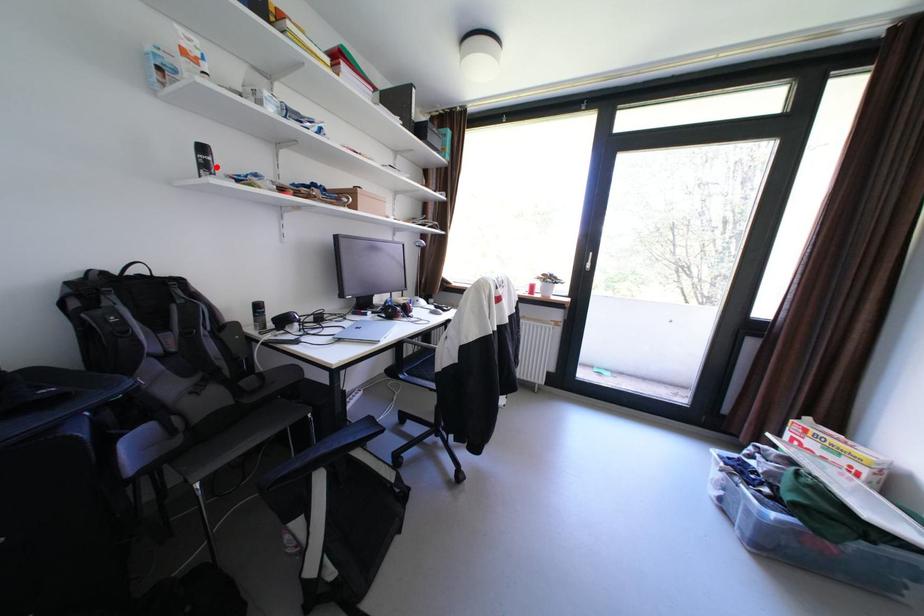
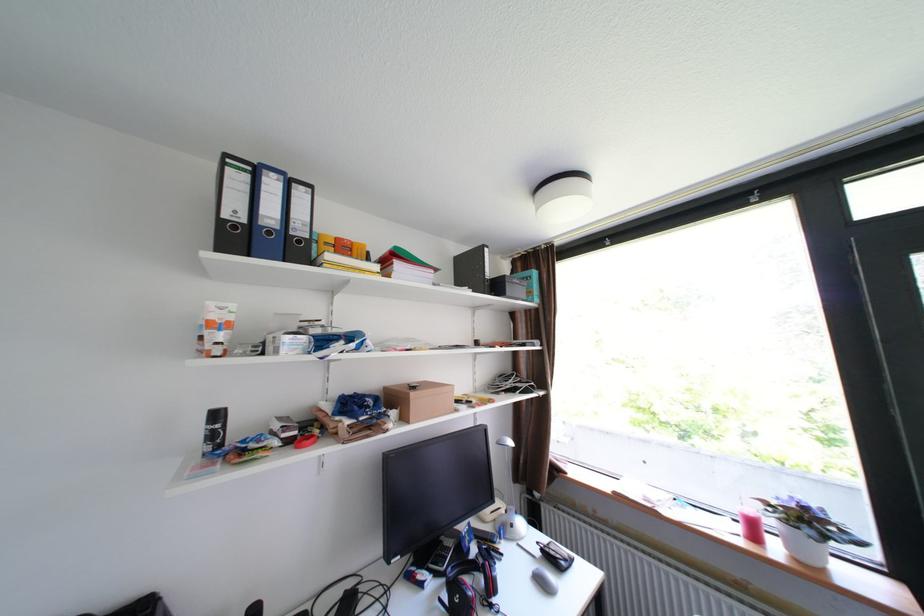
Find the pixel in the second image that matches the highlighted location in the first image.

(225, 436)